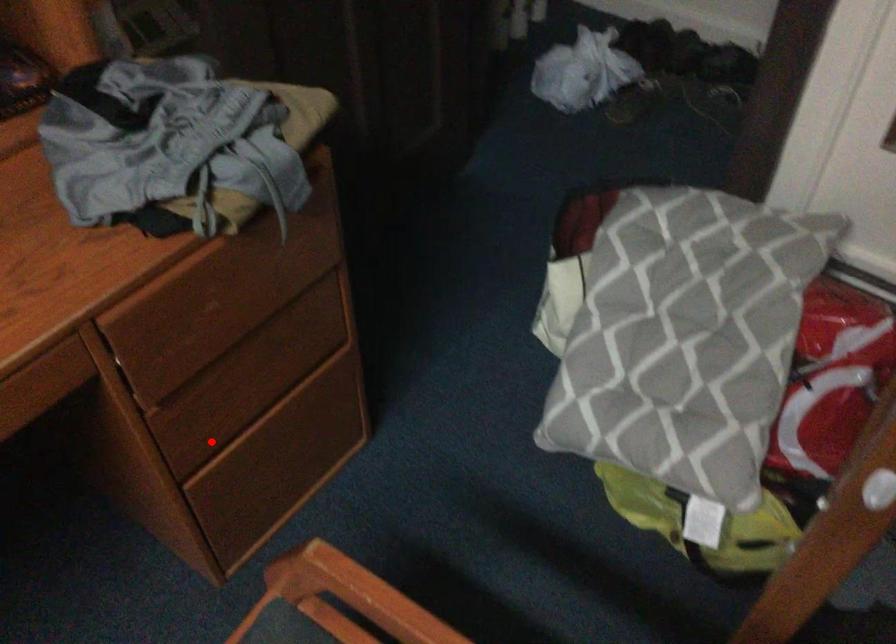
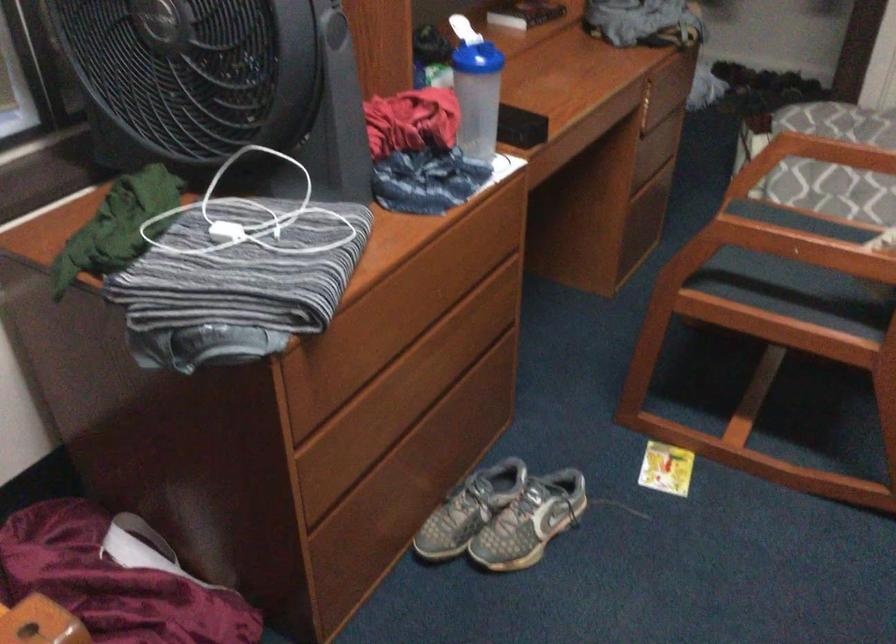
In the second image, find the point that corresponds to the highlighted location in the first image.

(643, 169)